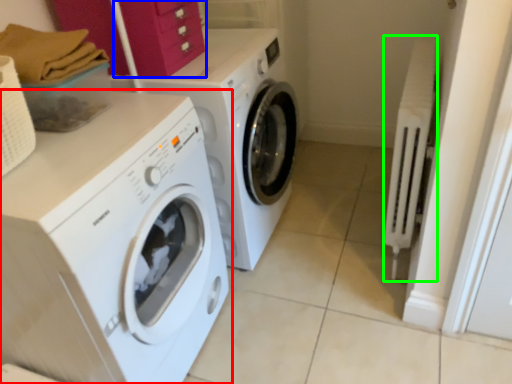
Question: Which object is the closest to the washing machine (highlighted by a red box)? Choose among these: drawer (highlighted by a blue box) or radiator (highlighted by a green box).

Choices:
 (A) drawer
 (B) radiator

Answer: (A)